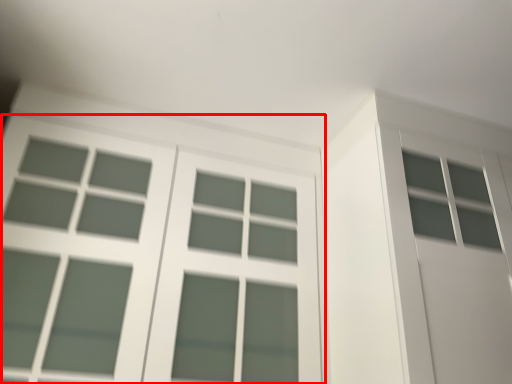
Question: From the image's perspective, what is the correct spatial relationship of window (annotated by the red box) in relation to screen door?

Choices:
 (A) above
 (B) below

Answer: (A)